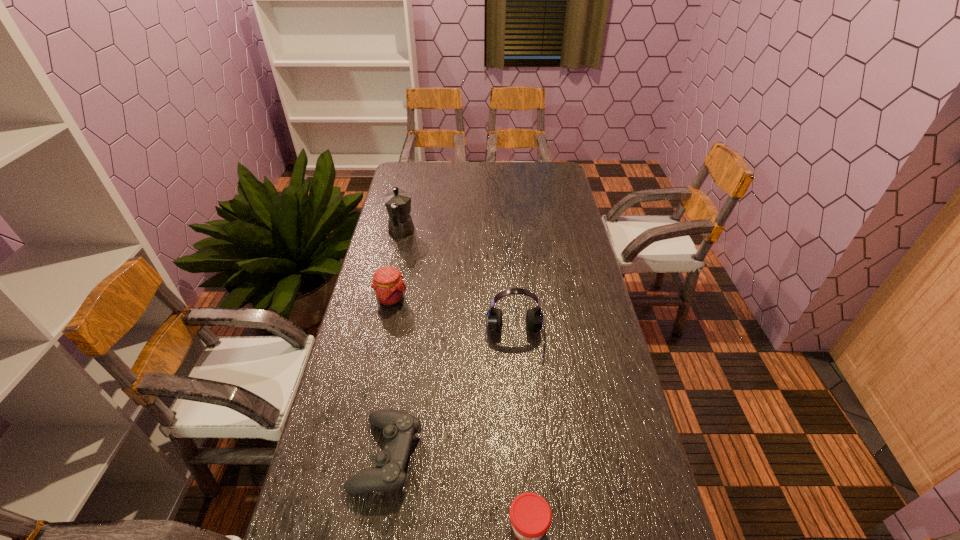
Find the location of a particular element. vacant area that lies between the taller jam and the third nearest object is located at coordinates point(453,320).

At what (x,y) coordinates should I click in order to perform the action: click on vacant region between the fourth farthest object and the headset. Please return your answer as a coordinate pair (x, y). The height and width of the screenshot is (540, 960). Looking at the image, I should click on (451, 397).

What are the coordinates of `free space between the left jam and the headset` in the screenshot? It's located at (453, 320).

The width and height of the screenshot is (960, 540). Find the location of `vacant space that is in between the third tallest object and the control`. vacant space that is in between the third tallest object and the control is located at coordinates (389, 377).

Find the location of a particular element. This screenshot has height=540, width=960. free space between the taller jam and the control is located at coordinates (389, 377).

At what (x,y) coordinates should I click in order to perform the action: click on free spot between the farthest object and the headset. Please return your answer as a coordinate pair (x, y). This screenshot has height=540, width=960. Looking at the image, I should click on (458, 287).

Identify the location of unoccupied area between the left jam and the farthest object. The height and width of the screenshot is (540, 960). pyautogui.click(x=396, y=266).

In order to click on free space that is in between the farthest object and the headset in this screenshot , I will do `click(458, 287)`.

Identify the location of free space between the tallest object and the third farthest object. The height and width of the screenshot is (540, 960). (458, 287).

The width and height of the screenshot is (960, 540). Identify the location of object that is the second closest one to the control. (534, 318).